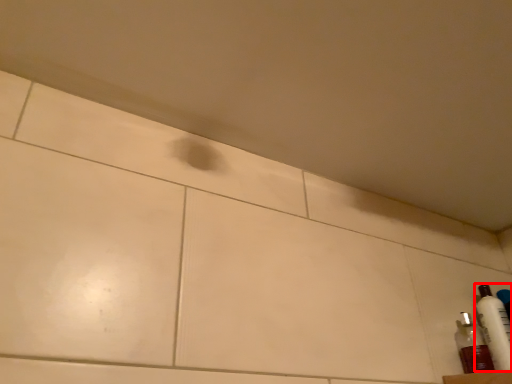
Question: Where is bottle (annotated by the red box) located in relation to bottle in the image?

Choices:
 (A) right
 (B) left

Answer: (A)